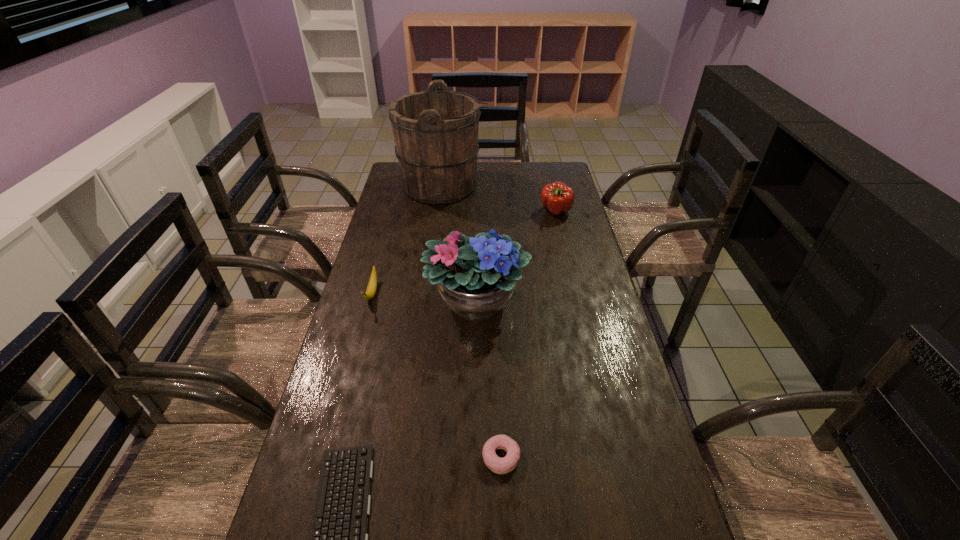
Locate an element on the screen. This screenshot has height=540, width=960. blank space that satisfies the following two spatial constraints: 1. at the stem of the third shortest object; 2. on the left side of the doughnut is located at coordinates pyautogui.click(x=327, y=457).